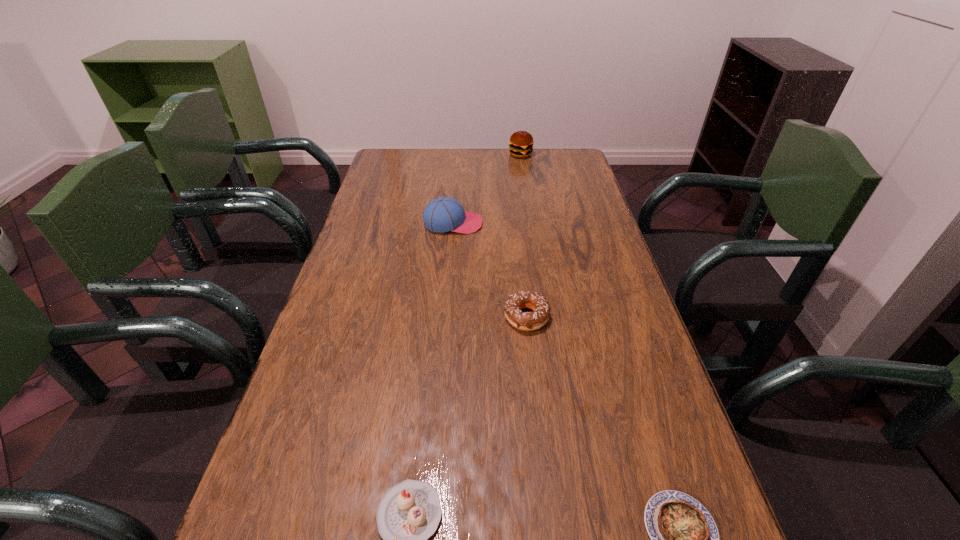
Identify the location of hamburger. (521, 143).

Where is `the fourth nearest object`? The width and height of the screenshot is (960, 540). the fourth nearest object is located at coordinates (443, 214).

This screenshot has width=960, height=540. I want to click on doughnut, so click(527, 321).

What are the coordinates of `free space located on the front of the farthest object` in the screenshot? It's located at (527, 195).

Image resolution: width=960 pixels, height=540 pixels. Find the location of `free space located 0.230m on the front-facing side of the second farthest object`. free space located 0.230m on the front-facing side of the second farthest object is located at coordinates (557, 223).

This screenshot has height=540, width=960. I want to click on vacant space positioned on the front of the doughnut, so click(x=547, y=499).

At what (x,y) coordinates should I click in order to perform the action: click on object that is at the far edge. Please return your answer as a coordinate pair (x, y). This screenshot has height=540, width=960. Looking at the image, I should click on (521, 143).

Identify the location of vacant space at the far edge. The height and width of the screenshot is (540, 960). (477, 170).

Where is `free space at the left edge of the desktop`? free space at the left edge of the desktop is located at coordinates (340, 464).

This screenshot has width=960, height=540. In the image, there is a desktop. In order to click on vacant area at the right edge in this screenshot , I will do `click(626, 530)`.